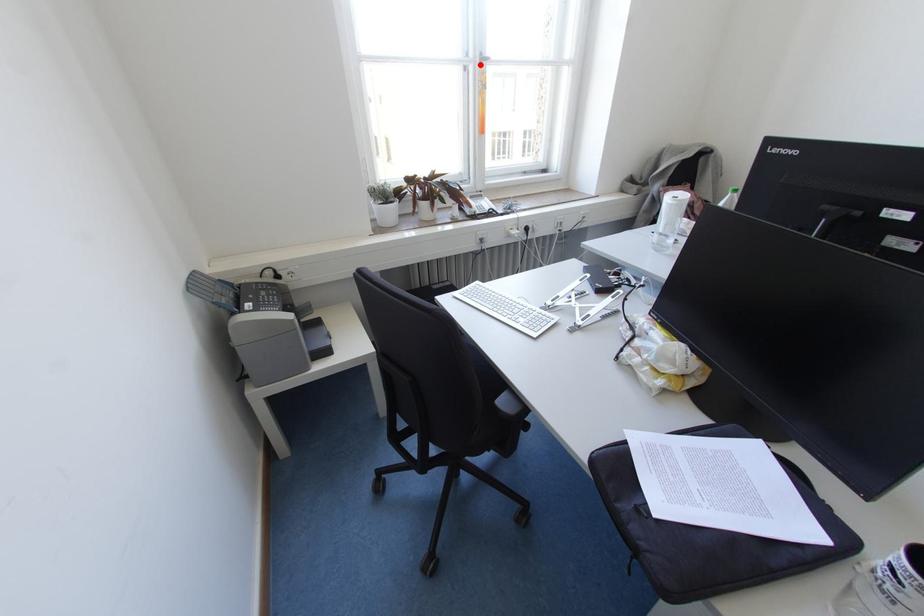
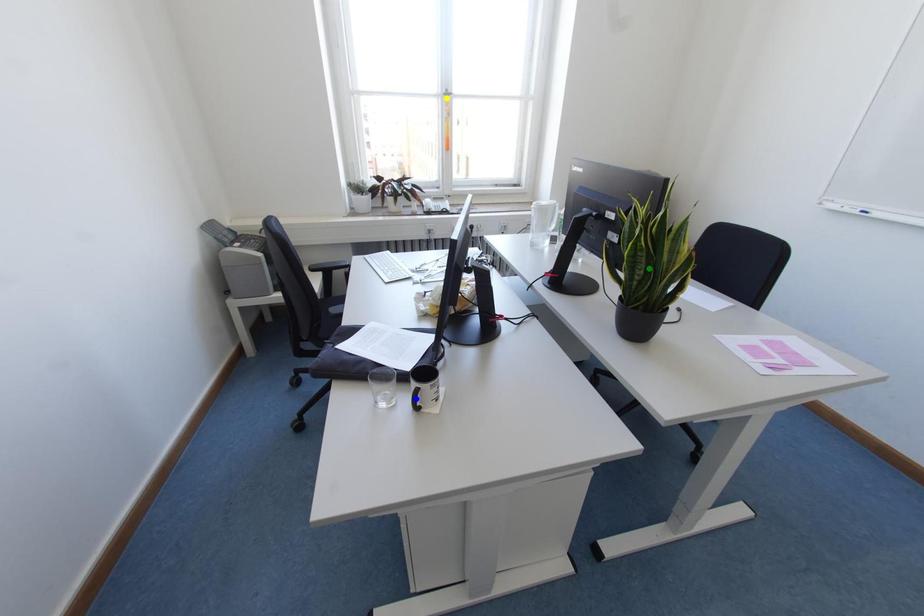
Question: I am providing you with two images of the same scene from different viewpoints. A red point is marked on the first image. You are given multiple points on the second image. Which spot in image 2 lines up with the point in image 1?

Choices:
 (A) green point
 (B) blue point
 (C) yellow point

Answer: (C)